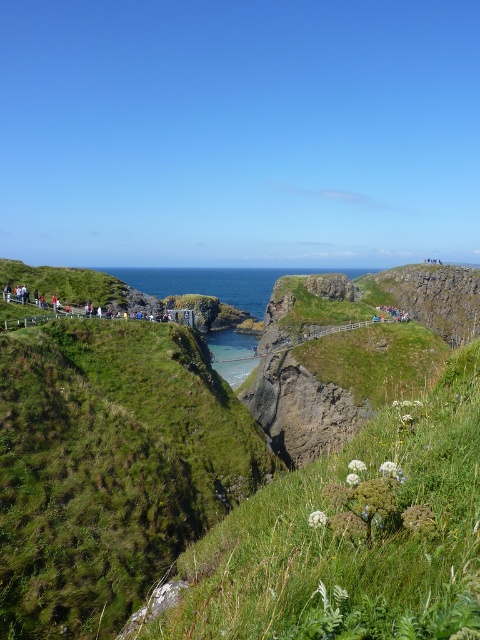
Is green grassy at center taller than blue water at center?

In fact, green grassy at center may be shorter than blue water at center.

Image resolution: width=480 pixels, height=640 pixels. I want to click on green grassy at center, so click(351, 536).

Which is above, green grassy at center or dark brown wooden railing at left?

dark brown wooden railing at left is higher up.

Between point (391, 522) and point (169, 317), which one is positioned behind?

The point (169, 317) is behind.

Where is `green grassy at center`? Image resolution: width=480 pixels, height=640 pixels. green grassy at center is located at coordinates (351, 536).

Consider the image. Who is shorter, blue water at center or dark brown wooden railing at left?

dark brown wooden railing at left

Does point (208, 336) lie in front of point (134, 308)?

No, it is not.

Describe the element at coordinates (208, 282) in the screenshot. Image resolution: width=480 pixels, height=640 pixels. I see `blue water at center` at that location.

Identify the location of blue water at center. This screenshot has height=640, width=480. (208, 282).